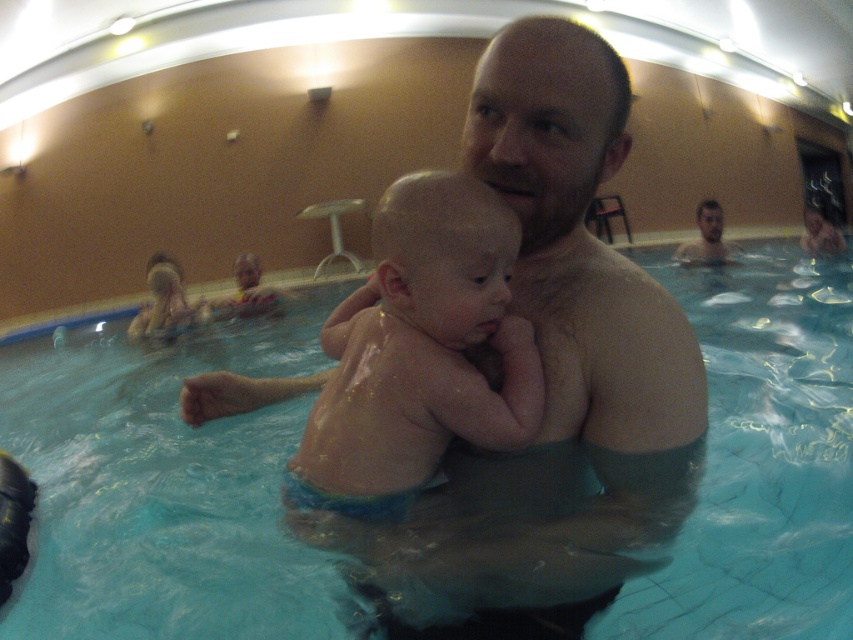
You are a lifeguard trying to ensure safety in the pool. You notice the blue smooth water at center and the smooth skin man at upper right. Which one has a greater width in the image?

The blue smooth water at center has a greater width than the smooth skin man at upper right according to the description.

You are a lifeguard standing at the edge of the pool and need to reach the blue smooth water at center to perform a rescue. Based on the coordinates provided, in which direction should you move to reach the water?

The blue smooth water at center is located at coordinates point (163, 492). Since the x and y coordinates are both positive, you should move diagonally towards the center of the pool to reach the water.